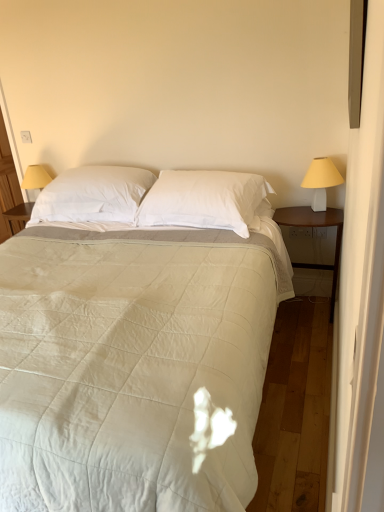
Question: Should I look upward or downward to see yellow fabric lampshade at left?

Choices:
 (A) down
 (B) up

Answer: (B)

Question: Can you confirm if yellow fabric lampshade at left is smaller than white soft pillow at center, marked as the 1th pillow in a left-to-right arrangement?

Choices:
 (A) no
 (B) yes

Answer: (B)

Question: Considering the relative positions of yellow fabric lampshade at left and white soft pillow at center, marked as the 1th pillow in a left-to-right arrangement, in the image provided, is yellow fabric lampshade at left to the left of white soft pillow at center, marked as the 1th pillow in a left-to-right arrangement, from the viewer's perspective?

Choices:
 (A) yes
 (B) no

Answer: (A)

Question: Is yellow fabric lampshade at left bigger than white soft pillow at center, marked as the 1th pillow in a left-to-right arrangement?

Choices:
 (A) no
 (B) yes

Answer: (A)

Question: Is the position of yellow fabric lampshade at left more distant than that of white soft pillow at center, marked as the 1th pillow in a left-to-right arrangement?

Choices:
 (A) yes
 (B) no

Answer: (A)

Question: Does yellow fabric lampshade at left have a greater height compared to white soft pillow at center, which is the 2th pillow in right-to-left order?

Choices:
 (A) yes
 (B) no

Answer: (B)

Question: Is the position of yellow fabric lampshade at left less distant than that of white soft pillow at center, which is the 2th pillow in right-to-left order?

Choices:
 (A) yes
 (B) no

Answer: (B)

Question: From the image's perspective, would you say white cotton pillow at center, which is counted as the first pillow, starting from the right, is shown under white quilted fabric bed at center?

Choices:
 (A) no
 (B) yes

Answer: (A)

Question: Can you confirm if white cotton pillow at center, which is counted as the first pillow, starting from the right, is shorter than white quilted fabric bed at center?

Choices:
 (A) no
 (B) yes

Answer: (B)

Question: From a real-world perspective, is white cotton pillow at center, arranged as the 2th pillow when viewed from the left, physically below white quilted fabric bed at center?

Choices:
 (A) no
 (B) yes

Answer: (A)

Question: Considering the relative sizes of white cotton pillow at center, which is counted as the first pillow, starting from the right, and white quilted fabric bed at center in the image provided, is white cotton pillow at center, which is counted as the first pillow, starting from the right, thinner than white quilted fabric bed at center?

Choices:
 (A) yes
 (B) no

Answer: (A)

Question: Is white cotton pillow at center, which is counted as the first pillow, starting from the right, taller than white quilted fabric bed at center?

Choices:
 (A) yes
 (B) no

Answer: (B)

Question: Is white cotton pillow at center, arranged as the 2th pillow when viewed from the left, placed right next to white quilted fabric bed at center?

Choices:
 (A) no
 (B) yes

Answer: (A)

Question: Is white plastic lampshade at right positioned with its back to white soft pillow at center, which is the 2th pillow in right-to-left order?

Choices:
 (A) yes
 (B) no

Answer: (B)